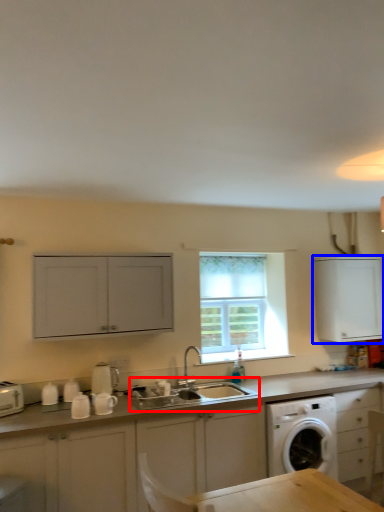
Question: Which object appears farthest to the camera in this image, sink (highlighted by a red box) or cabinetry (highlighted by a blue box)?

Choices:
 (A) sink
 (B) cabinetry

Answer: (B)